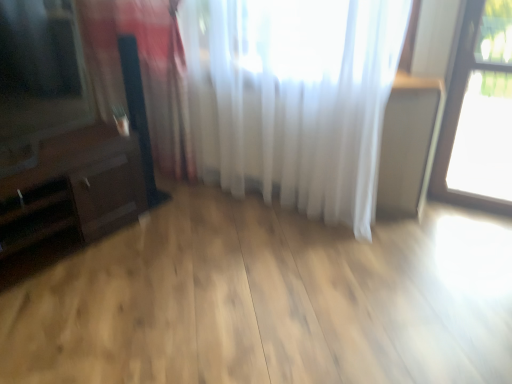
This screenshot has height=384, width=512. What do you see at coordinates (69, 198) in the screenshot? I see `dark brown wood dresser at left` at bounding box center [69, 198].

Find the location of a particular element. This screenshot has height=384, width=512. white sheer curtain at left, the 2th curtain in the right-to-left sequence is located at coordinates (144, 71).

What do you see at coordinates (40, 67) in the screenshot? Image resolution: width=512 pixels, height=384 pixels. I see `matte black tv at left` at bounding box center [40, 67].

The height and width of the screenshot is (384, 512). I want to click on dark brown wood dresser at left, so click(x=69, y=198).

Considering the relative sizes of dark brown wood dresser at left and white sheer curtain at left, the 2th curtain in the right-to-left sequence, in the image provided, is dark brown wood dresser at left taller than white sheer curtain at left, the 2th curtain in the right-to-left sequence,?

In fact, dark brown wood dresser at left may be shorter than white sheer curtain at left, the 2th curtain in the right-to-left sequence.

Which is closer to the camera, (x=83, y=232) or (x=179, y=157)?

Point (x=83, y=232)

From the image's perspective, does dark brown wood dresser at left appear lower than white sheer curtain at left, which is the first curtain in left-to-right order?

Yes.

Is matte black tv at left outside of white sheer curtain at left, the 2th curtain in the right-to-left sequence?

Yes.

From the matte black tv at left, count 2nd curtains backward and point to it. Please provide its 2D coordinates.

[(144, 71)]

From the image's perspective, relative to white sheer curtain at left, which is the first curtain in left-to-right order, is matte black tv at left above or below?

From the image's perspective, matte black tv at left appears above white sheer curtain at left, which is the first curtain in left-to-right order.

From the image's perspective, is matte black tv at left on white sheer curtain at upper center, the 2th curtain in the left-to-right sequence?

Incorrect, from the image's perspective, matte black tv at left is lower than white sheer curtain at upper center, the 2th curtain in the left-to-right sequence.

Does matte black tv at left have a greater height compared to white sheer curtain at upper center, placed as the 1th curtain when sorted from right to left?

No.

Can you confirm if matte black tv at left is wider than white sheer curtain at upper center, placed as the 1th curtain when sorted from right to left?

Correct, the width of matte black tv at left exceeds that of white sheer curtain at upper center, placed as the 1th curtain when sorted from right to left.

Relative to white sheer curtain at upper center, placed as the 1th curtain when sorted from right to left, is matte black tv at left in front or behind?

Clearly, matte black tv at left is in front of white sheer curtain at upper center, placed as the 1th curtain when sorted from right to left.

Is transparent glass window at upper right far from matte black tv at left?

Yes, transparent glass window at upper right and matte black tv at left are quite far apart.

Is point (469, 199) positioned after point (16, 126)?

That is True.

In the image, there is a matte black tv at left. What are the coordinates of `window below it (from the image's perspective)` in the screenshot? It's located at (465, 110).

Is transparent glass window at upper right completely or partially outside of matte black tv at left?

Yes, transparent glass window at upper right is not within matte black tv at left.

Based on their sizes in the image, would you say matte black tv at left is bigger or smaller than dark brown wood dresser at left?

Considering their sizes, matte black tv at left takes up less space than dark brown wood dresser at left.

From the image's perspective, which object appears higher, matte black tv at left or dark brown wood dresser at left?

matte black tv at left is shown above in the image.

Are matte black tv at left and dark brown wood dresser at left far apart?

Actually, matte black tv at left and dark brown wood dresser at left are a little close together.

Is point (63, 111) positioned in front of point (124, 168)?

Yes, it is in front of point (124, 168).

Which of these two, dark brown wood dresser at left or matte black tv at left, is thinner?

matte black tv at left.

From the picture: From their relative heights in the image, would you say dark brown wood dresser at left is taller or shorter than matte black tv at left?

In the image, dark brown wood dresser at left appears to be shorter than matte black tv at left.

I want to click on window screen in front of the dark brown wood dresser at left, so click(40, 67).

Is dark brown wood dresser at left surrounding matte black tv at left?

No, matte black tv at left is located outside of dark brown wood dresser at left.

From the image's perspective, does dark brown wood dresser at left appear higher than transparent glass window at upper right?

No, from the image's perspective, dark brown wood dresser at left is not above transparent glass window at upper right.

Is dark brown wood dresser at left in front of or behind transparent glass window at upper right in the image?

dark brown wood dresser at left is positioned closer to the viewer than transparent glass window at upper right.

Does dark brown wood dresser at left turn towards transparent glass window at upper right?

No, dark brown wood dresser at left is not oriented towards transparent glass window at upper right.

Does dark brown wood dresser at left have a larger size compared to transparent glass window at upper right?

Correct, dark brown wood dresser at left is larger in size than transparent glass window at upper right.

Identify the location of dresser that appears on the left of white sheer curtain at left, which is the first curtain in left-to-right order. (69, 198).

Locate an element on the screen. the 2nd curtain below the matte black tv at left (from a real-world perspective) is located at coordinates (144, 71).

From the image, which object appears to be farther from white sheer curtain at upper center, the 2th curtain in the left-to-right sequence, white sheer curtain at left, which is the first curtain in left-to-right order, or transparent glass window at upper right?

Based on the image, transparent glass window at upper right appears to be further to white sheer curtain at upper center, the 2th curtain in the left-to-right sequence.

Which object lies nearer to the anchor point white sheer curtain at left, which is the first curtain in left-to-right order, transparent glass window at upper right or white sheer curtain at upper center, placed as the 1th curtain when sorted from right to left?

The object closer to white sheer curtain at left, which is the first curtain in left-to-right order, is white sheer curtain at upper center, placed as the 1th curtain when sorted from right to left.

When comparing their distances from matte black tv at left, does white sheer curtain at left, which is the first curtain in left-to-right order, or transparent glass window at upper right seem closer?

white sheer curtain at left, which is the first curtain in left-to-right order.

Which object lies nearer to the anchor point transparent glass window at upper right, matte black tv at left or dark brown wood dresser at left?

Among the two, dark brown wood dresser at left is located nearer to transparent glass window at upper right.

From the picture: When comparing their distances from transparent glass window at upper right, does white sheer curtain at left, the 2th curtain in the right-to-left sequence, or matte black tv at left seem closer?

white sheer curtain at left, the 2th curtain in the right-to-left sequence, is positioned closer to the anchor transparent glass window at upper right.

Which object lies further to the anchor point matte black tv at left, white sheer curtain at upper center, the 2th curtain in the left-to-right sequence, or dark brown wood dresser at left?

Among the two, white sheer curtain at upper center, the 2th curtain in the left-to-right sequence, is located further to matte black tv at left.

Looking at this image, when comparing their distances from dark brown wood dresser at left, does matte black tv at left or white sheer curtain at left, which is the first curtain in left-to-right order, seem closer?

matte black tv at left is positioned closer to the anchor dark brown wood dresser at left.

Which object lies further to the anchor point dark brown wood dresser at left, transparent glass window at upper right or matte black tv at left?

transparent glass window at upper right is positioned further to the anchor dark brown wood dresser at left.

Locate an element on the screen. The image size is (512, 384). window screen between dark brown wood dresser at left and white sheer curtain at upper center, placed as the 1th curtain when sorted from right to left is located at coordinates (40, 67).

The image size is (512, 384). In order to click on curtain located between matte black tv at left and white sheer curtain at upper center, placed as the 1th curtain when sorted from right to left, in the left-right direction in this screenshot , I will do `click(144, 71)`.

The image size is (512, 384). Find the location of `window screen between dark brown wood dresser at left and transparent glass window at upper right from left to right`. window screen between dark brown wood dresser at left and transparent glass window at upper right from left to right is located at coordinates (40, 67).

Where is `curtain between white sheer curtain at left, which is the first curtain in left-to-right order, and transparent glass window at upper right`? curtain between white sheer curtain at left, which is the first curtain in left-to-right order, and transparent glass window at upper right is located at coordinates point(294,97).